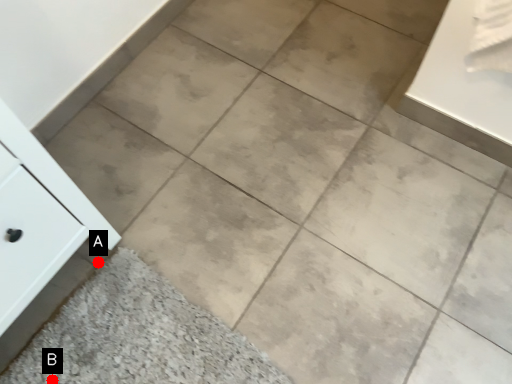
Question: Two points are circled on the image, labeled by A and B beside each circle. Which of the following is the farthest from the observer?

Choices:
 (A) A is further
 (B) B is further

Answer: (A)